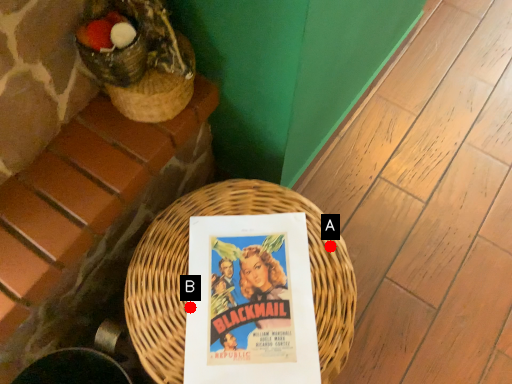
Question: Two points are circled on the image, labeled by A and B beside each circle. Which point is further to the camera?

Choices:
 (A) A is further
 (B) B is further

Answer: (A)